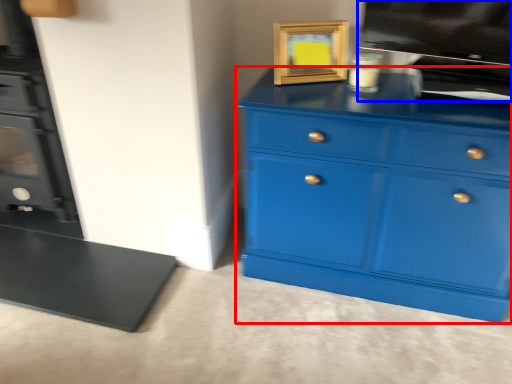
Question: Among these objects, which one is farthest to the camera, chest of drawers (highlighted by a red box) or appliance (highlighted by a blue box)?

Choices:
 (A) chest of drawers
 (B) appliance

Answer: (B)